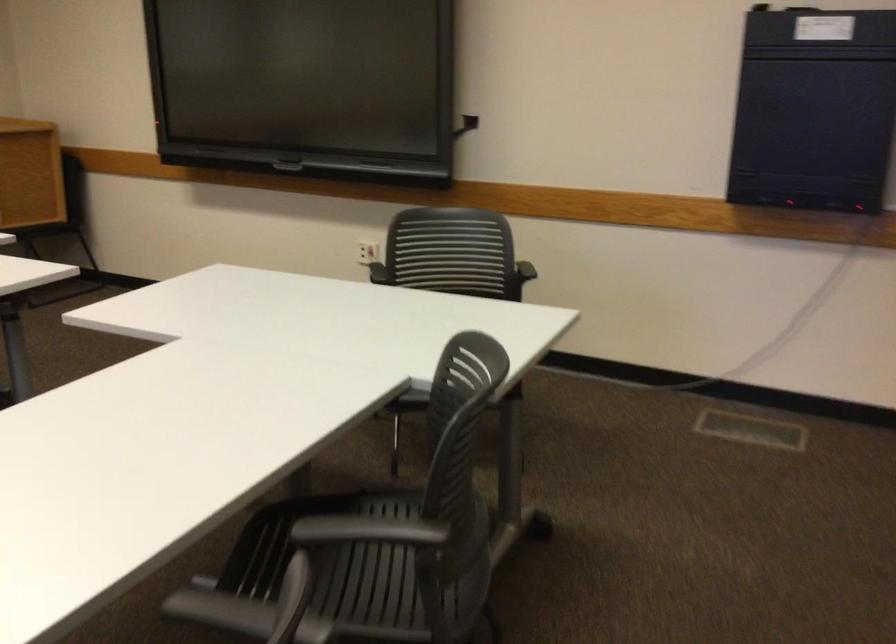
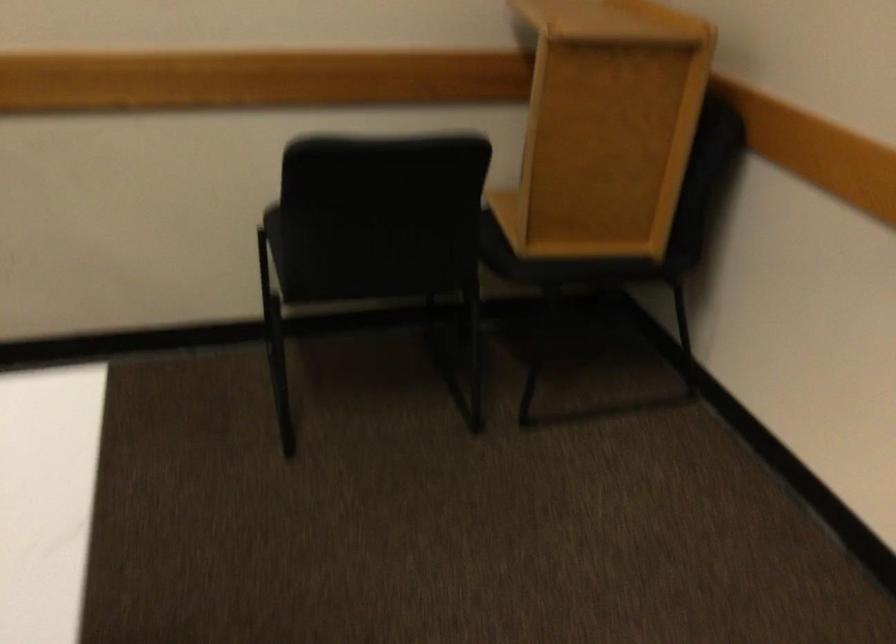
In the second image, find the point that corresponds to (99,140) in the first image.

(605, 127)